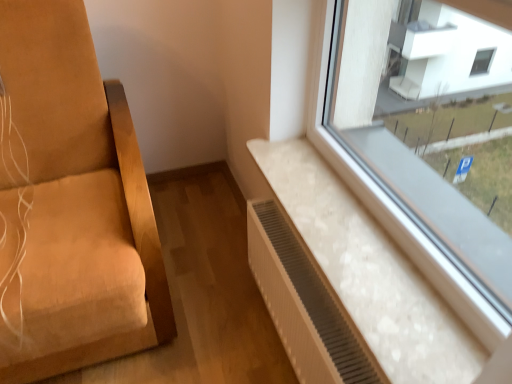
Find the location of a particular element. vacant space situated above white textured radiator at lower right (from a real-world perspective) is located at coordinates (304, 273).